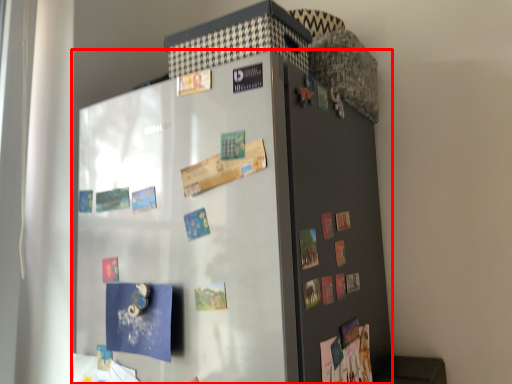
Question: From the image's perspective, where is refrigerator (annotated by the red box) located in relation to door in the image?

Choices:
 (A) below
 (B) above

Answer: (A)